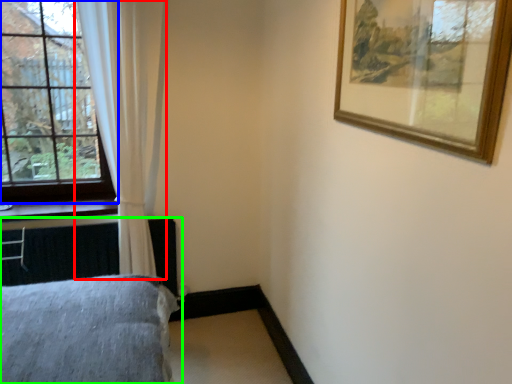
Question: Estimate the real-world distances between objects in this image. Which object is farther from curtain (highlighted by a red box), window (highlighted by a blue box) or bed (highlighted by a green box)?

Choices:
 (A) window
 (B) bed

Answer: (B)